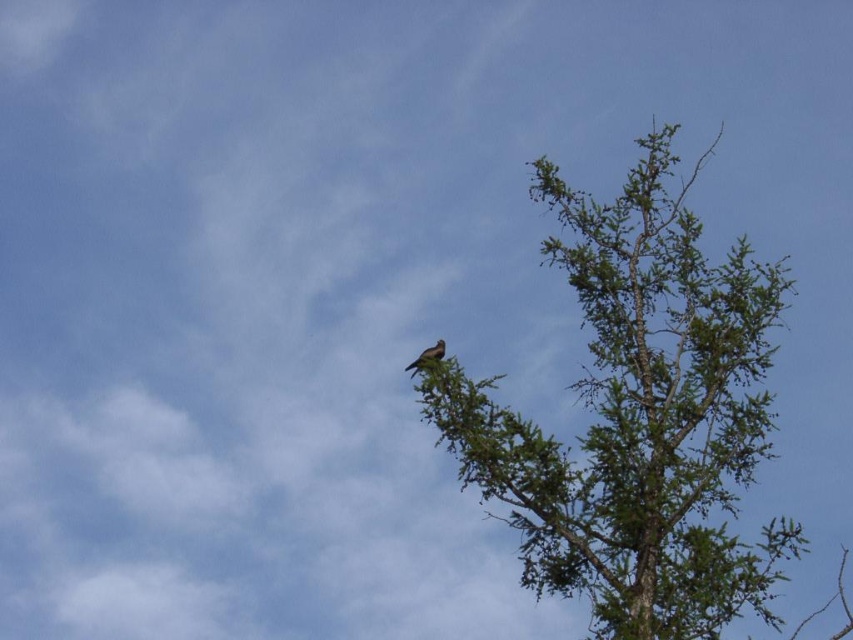
Who is more forward, (550, 177) or (440, 349)?

Point (440, 349)

Is point (621, 288) closer to camera compared to point (421, 353)?

No, (621, 288) is further to viewer.

I want to click on green textured tree at upper right, so click(x=639, y=419).